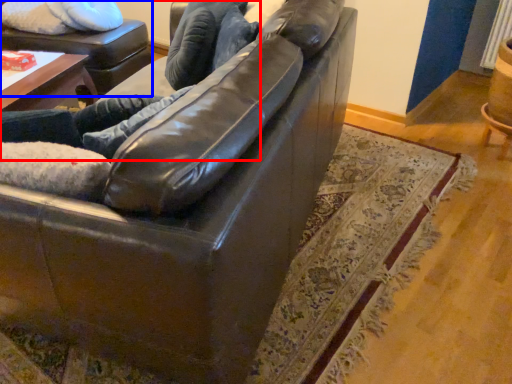
Question: Which object appears closest to the camera in this image, couple (highlighted by a red box) or swivel chair (highlighted by a blue box)?

Choices:
 (A) couple
 (B) swivel chair

Answer: (A)